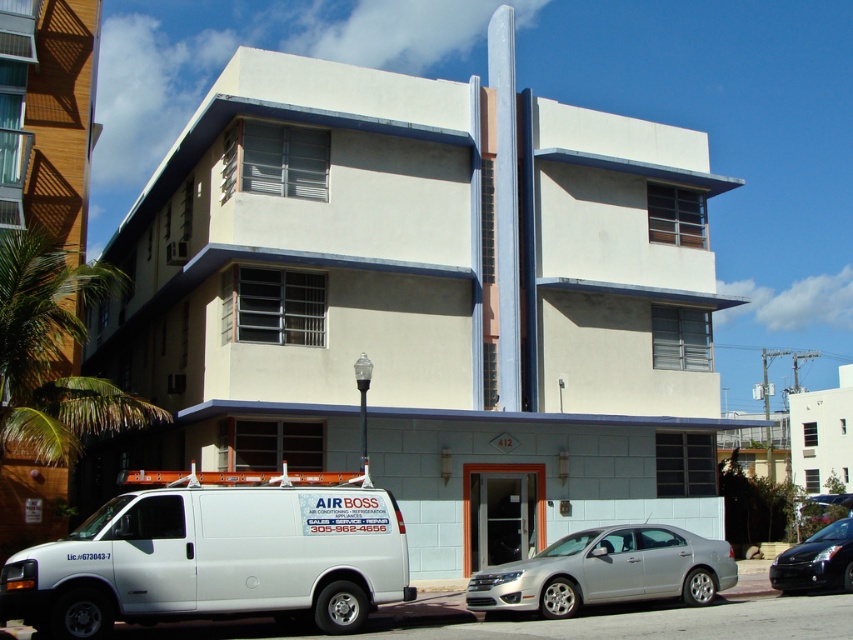
You are a delivery person needing to park your 3.5 meter long truck between the silver metallic sedan at center and the shiny black sedan at lower right. Can you fit your truck in that space?

The silver metallic sedan at center occupies less space than the shiny black sedan at lower right, so there is sufficient space between them to park a 3.5 meter long truck.

You are standing at the point with coordinates point (x=659, y=540) and want to walk to the entrance of the building. There is a point (x=256, y=516) blocking your path. Can you walk around it to reach the entrance?

Point (x=256, y=516) is in front of point (x=659, y=540), so you can walk around it to reach the entrance.